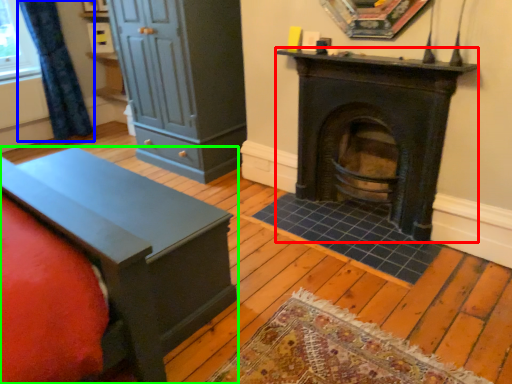
Question: Which object is the closest to the wood burning stove (highlighted by a red box)? Choose among these: curtain (highlighted by a blue box) or furniture (highlighted by a green box).

Choices:
 (A) curtain
 (B) furniture

Answer: (B)